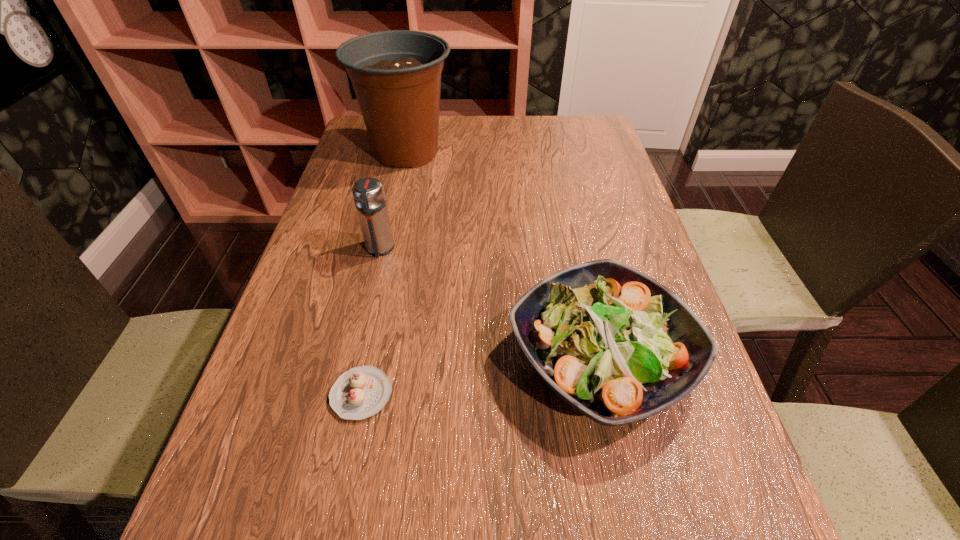
Image resolution: width=960 pixels, height=540 pixels. I want to click on the farthest object, so click(x=396, y=75).

Find the location of a particular element. This screenshot has width=960, height=540. flowerpot is located at coordinates (396, 75).

You are a GUI agent. You are given a task and a screenshot of the screen. Output one action in this format:
    pyautogui.click(x=<x>, y=<y>)
    Task: Click on the third shortest object
    The image size is (960, 540).
    Given the screenshot: What is the action you would take?
    pyautogui.click(x=368, y=193)

Identify the location of thermos bottle. (368, 193).

The height and width of the screenshot is (540, 960). In order to click on salad plate in this screenshot , I will do `click(615, 344)`.

Find the location of `the third tallest object`. the third tallest object is located at coordinates (615, 344).

Where is `the shortest object`? The width and height of the screenshot is (960, 540). the shortest object is located at coordinates (361, 392).

You are a GUI agent. You are given a task and a screenshot of the screen. Output one action in this format:
    pyautogui.click(x=<x>, y=<y>)
    Task: Click on the vacant space located on the right of the flowerpot
    The height and width of the screenshot is (540, 960).
    Given the screenshot: What is the action you would take?
    pyautogui.click(x=558, y=152)

At what (x,y) coordinates should I click in order to perform the action: click on vacant space located with a handle on the side of the second farthest object. Please return your answer as a coordinate pair (x, y). Looking at the image, I should click on (371, 286).

At what (x,y) coordinates should I click in order to perform the action: click on free space located 0.160m on the back of the third tallest object. Please return your answer as a coordinate pair (x, y). This screenshot has width=960, height=540. Looking at the image, I should click on (573, 239).